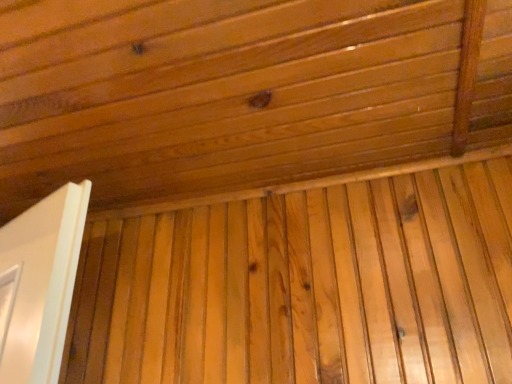
Question: Considering the relative sizes of natural wood plywood at center and natural wood ceiling at upper center in the image provided, is natural wood plywood at center shorter than natural wood ceiling at upper center?

Choices:
 (A) no
 (B) yes

Answer: (A)

Question: From the image's perspective, does natural wood plywood at center appear lower than natural wood ceiling at upper center?

Choices:
 (A) no
 (B) yes

Answer: (B)

Question: From a real-world perspective, is natural wood plywood at center beneath natural wood ceiling at upper center?

Choices:
 (A) yes
 (B) no

Answer: (A)

Question: Is the position of natural wood plywood at center less distant than that of natural wood ceiling at upper center?

Choices:
 (A) yes
 (B) no

Answer: (B)

Question: Is natural wood plywood at center in contact with natural wood ceiling at upper center?

Choices:
 (A) yes
 (B) no

Answer: (B)

Question: From the image's perspective, is natural wood plywood at center on top of natural wood ceiling at upper center?

Choices:
 (A) no
 (B) yes

Answer: (A)

Question: Could you tell me if natural wood ceiling at upper center is facing natural wood plywood at center?

Choices:
 (A) yes
 (B) no

Answer: (B)

Question: Does natural wood ceiling at upper center have a larger size compared to natural wood plywood at center?

Choices:
 (A) no
 (B) yes

Answer: (B)

Question: From a real-world perspective, does natural wood ceiling at upper center stand above natural wood plywood at center?

Choices:
 (A) no
 (B) yes

Answer: (B)

Question: From the image's perspective, would you say natural wood ceiling at upper center is positioned over natural wood plywood at center?

Choices:
 (A) yes
 (B) no

Answer: (A)

Question: Is natural wood ceiling at upper center next to natural wood plywood at center?

Choices:
 (A) yes
 (B) no

Answer: (B)

Question: Is natural wood ceiling at upper center taller than natural wood plywood at center?

Choices:
 (A) yes
 (B) no

Answer: (B)

Question: From a real-world perspective, is natural wood ceiling at upper center positioned above or below natural wood plywood at center?

Choices:
 (A) below
 (B) above

Answer: (B)